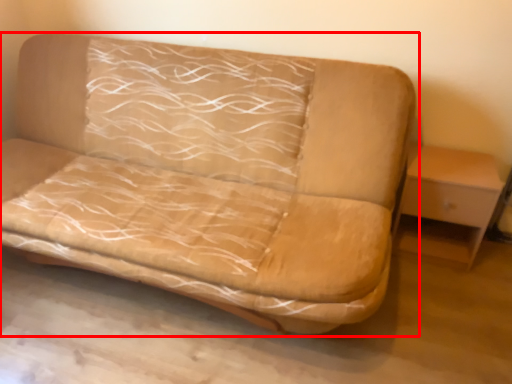
Question: Considering the relative positions of studio couch (annotated by the red box) and table in the image provided, where is studio couch (annotated by the red box) located with respect to the staircase?

Choices:
 (A) left
 (B) right

Answer: (A)